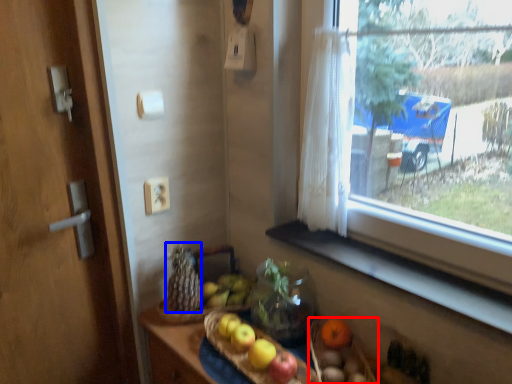
Question: Which of the following is the farthest to the observer, basket (highlighted by a red box) or food (highlighted by a blue box)?

Choices:
 (A) basket
 (B) food

Answer: (B)